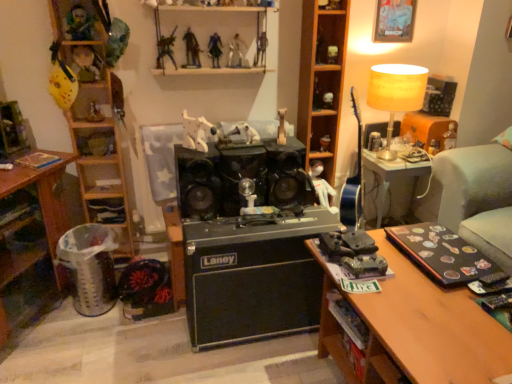
Question: Is wooden shelf at lower left, which is the 2th shelf in left-to-right order, in front of metallic silver toy at right, which is counted as the 1th toy, starting from the right?

Choices:
 (A) no
 (B) yes

Answer: (B)

Question: Is wooden shelf at lower left, the 4th shelf viewed from the right, wider than metallic silver toy at right, which is counted as the fifteenth toy, starting from the left?

Choices:
 (A) no
 (B) yes

Answer: (B)

Question: From a real-world perspective, is wooden shelf at lower left, which is the 2th shelf in left-to-right order, on metallic silver toy at right, which is counted as the fifteenth toy, starting from the left?

Choices:
 (A) no
 (B) yes

Answer: (A)

Question: Is wooden shelf at lower left, which is the 2th shelf in left-to-right order, not within metallic silver toy at right, which is counted as the fifteenth toy, starting from the left?

Choices:
 (A) no
 (B) yes

Answer: (B)

Question: Can you confirm if wooden shelf at lower left, which is the 2th shelf in left-to-right order, is bigger than metallic silver toy at right, which is counted as the fifteenth toy, starting from the left?

Choices:
 (A) no
 (B) yes

Answer: (B)

Question: Is point (234, 125) positioned closer to the camera than point (327, 51)?

Choices:
 (A) farther
 (B) closer

Answer: (B)

Question: Would you say white matte toy at center, arranged as the 7th toy when viewed from the right, is to the left or to the right of matte plastic toy at upper center, the third toy when ordered from right to left, in the picture?

Choices:
 (A) left
 (B) right

Answer: (A)

Question: Considering the positions of white matte toy at center, which is the ninth toy from left to right, and matte plastic toy at upper center, acting as the 13th toy starting from the left, in the image, is white matte toy at center, which is the ninth toy from left to right, taller or shorter than matte plastic toy at upper center, acting as the 13th toy starting from the left,?

Choices:
 (A) short
 (B) tall

Answer: (B)

Question: Based on their sizes in the image, would you say white matte toy at center, arranged as the 7th toy when viewed from the right, is bigger or smaller than matte plastic toy at upper center, the third toy when ordered from right to left?

Choices:
 (A) small
 (B) big

Answer: (B)

Question: Would you say wooden shelf at center, the 1th shelf from the right, is inside or outside metallic silver robot at upper center, which is the fourth toy from left to right?

Choices:
 (A) outside
 (B) inside

Answer: (A)

Question: From their relative heights in the image, would you say wooden shelf at center, which ranks as the 5th shelf in left-to-right order, is taller or shorter than metallic silver robot at upper center, the 12th toy from the right?

Choices:
 (A) short
 (B) tall

Answer: (B)

Question: Considering the positions of point (315, 39) and point (167, 51), is point (315, 39) closer or farther from the camera than point (167, 51)?

Choices:
 (A) farther
 (B) closer

Answer: (A)

Question: From a real-world perspective, relative to metallic silver robot at upper center, which is the fourth toy from left to right, is wooden shelf at center, which ranks as the 5th shelf in left-to-right order, vertically above or below?

Choices:
 (A) above
 (B) below

Answer: (B)

Question: In the image, is metallic silver toy at right, which is counted as the 1th toy, starting from the right, on the left side or the right side of wooden shelf at left, which appears as the 3th shelf when viewed from the left?

Choices:
 (A) right
 (B) left

Answer: (A)

Question: Relative to wooden shelf at left, which appears as the 3th shelf when viewed from the left, is metallic silver toy at right, which is counted as the 1th toy, starting from the right, in front or behind?

Choices:
 (A) front
 (B) behind

Answer: (B)